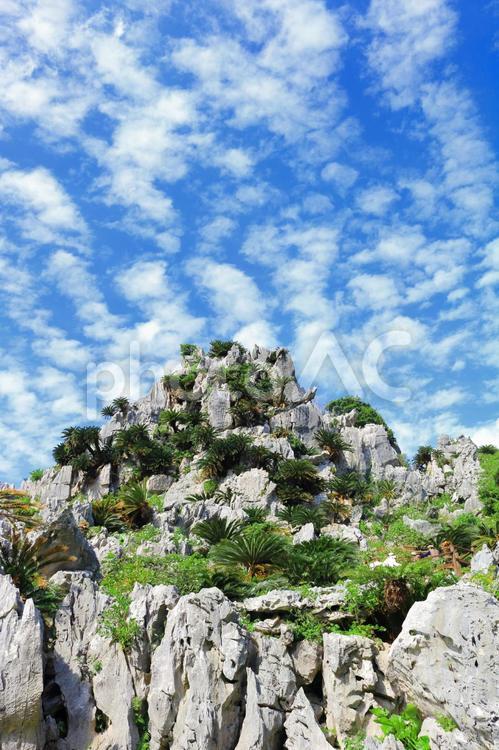
Where is `green leafy plants`? This screenshot has height=750, width=499. green leafy plants is located at coordinates click(133, 576), click(398, 529), click(491, 468), click(411, 723).